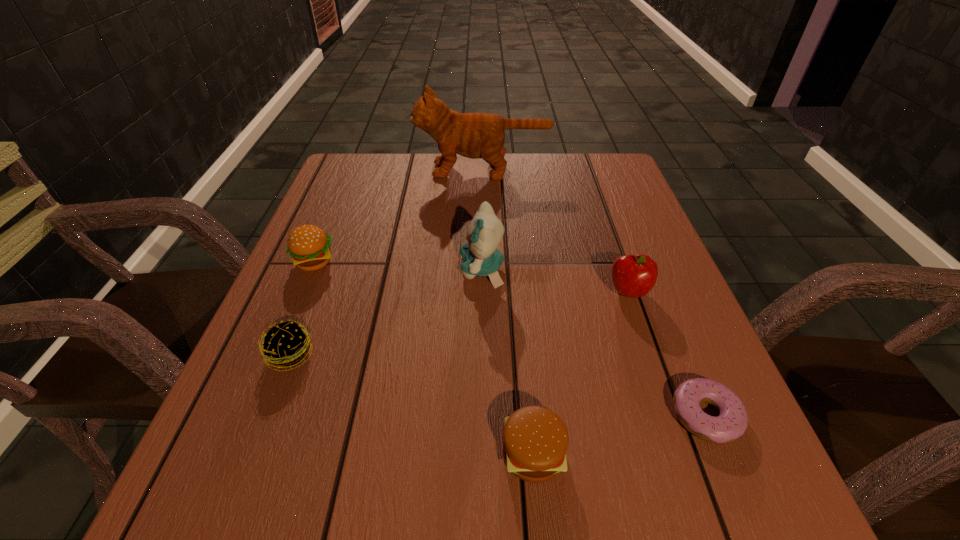
In the image, there is a desktop. Where is `vacant space at the right edge`? The width and height of the screenshot is (960, 540). vacant space at the right edge is located at coordinates (616, 249).

Locate an element on the screen. This screenshot has width=960, height=540. vacant area at the near right corner of the desktop is located at coordinates (766, 530).

This screenshot has height=540, width=960. Identify the location of vacant area that lies between the tallest object and the left hamburger. (398, 216).

At what (x,y) coordinates should I click in order to perform the action: click on blank region between the taller hamburger and the patty. Please return your answer as a coordinate pair (x, y). The image size is (960, 540). Looking at the image, I should click on (302, 308).

Where is `vacant space that's between the fifth farthest object and the doughnut`? Image resolution: width=960 pixels, height=540 pixels. vacant space that's between the fifth farthest object and the doughnut is located at coordinates (498, 385).

Locate an element on the screen. The width and height of the screenshot is (960, 540). vacant area between the patty and the farther hamburger is located at coordinates [302, 308].

Find the location of `vacant space in between the apple and the farthest object`. vacant space in between the apple and the farthest object is located at coordinates (556, 232).

You are a GUI agent. You are given a task and a screenshot of the screen. Output one action in this format:
    pyautogui.click(x=<x>, y=<y>)
    Task: Click on the vacant area that lies between the kitten and the apple
    
    Given the screenshot: What is the action you would take?
    pyautogui.click(x=555, y=281)

Find the location of a particular element. The height and width of the screenshot is (540, 960). vacant space that is in between the doughnut and the left hamburger is located at coordinates (511, 339).

Image resolution: width=960 pixels, height=540 pixels. What are the coordinates of `empty location between the farther hamburger and the doughnut` in the screenshot? It's located at (511, 339).